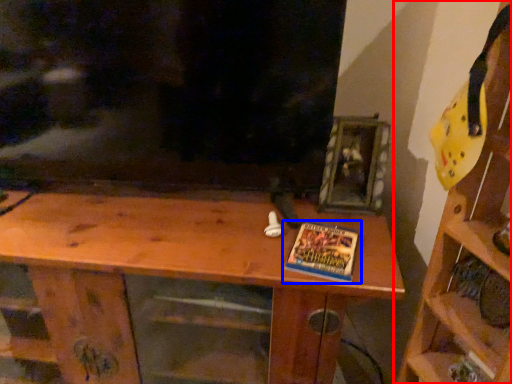
Question: Which of the following is the closest to the observer, shelf (highlighted by a red box) or book (highlighted by a blue box)?

Choices:
 (A) shelf
 (B) book

Answer: (A)